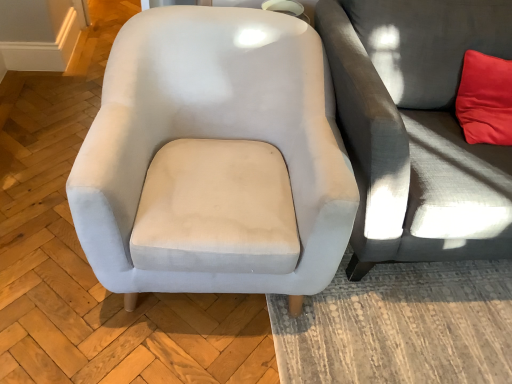
The image size is (512, 384). What do you see at coordinates (214, 159) in the screenshot?
I see `satin light gray armchair at center` at bounding box center [214, 159].

Find the location of a particular element. This screenshot has height=384, width=512. satin light gray armchair at center is located at coordinates (214, 159).

Image resolution: width=512 pixels, height=384 pixels. What do you see at coordinates (417, 128) in the screenshot? I see `gray fabric couch at right` at bounding box center [417, 128].

Locate an element on the screen. This screenshot has height=384, width=512. gray fabric couch at right is located at coordinates (417, 128).

You are a GUI agent. You are given a task and a screenshot of the screen. Output one action in this format:
    pyautogui.click(x=<x>, y=<y>)
    Task: Click on the satin light gray armchair at center
    
    Given the screenshot: What is the action you would take?
    pyautogui.click(x=214, y=159)

Considering the positions of objects satin light gray armchair at center and gray fabric couch at right in the image provided, who is more to the left, satin light gray armchair at center or gray fabric couch at right?

Positioned to the left is satin light gray armchair at center.

Is the depth of satin light gray armchair at center greater than that of gray fabric couch at right?

No.

Considering the points (188, 27) and (430, 36), which point is in front, point (188, 27) or point (430, 36)?

Positioned in front is point (188, 27).

From the image's perspective, which is above, satin light gray armchair at center or gray fabric couch at right?

gray fabric couch at right, from the image's perspective.

From a real-world perspective, is satin light gray armchair at center positioned under gray fabric couch at right based on gravity?

Correct, in the physical world, satin light gray armchair at center is lower than gray fabric couch at right.

Is satin light gray armchair at center wider or thinner than gray fabric couch at right?

Considering their sizes, satin light gray armchair at center looks slimmer than gray fabric couch at right.

Is satin light gray armchair at center taller than gray fabric couch at right?

No, satin light gray armchair at center is not taller than gray fabric couch at right.

Does satin light gray armchair at center have a smaller size compared to gray fabric couch at right?

Indeed, satin light gray armchair at center has a smaller size compared to gray fabric couch at right.

Could gray fabric couch at right be considered to be inside satin light gray armchair at center?

No, gray fabric couch at right is not inside satin light gray armchair at center.

Is satin light gray armchair at center with gray fabric couch at right?

satin light gray armchair at center and gray fabric couch at right are not in contact.

Is satin light gray armchair at center oriented away from gray fabric couch at right?

No, satin light gray armchair at center is not facing the opposite direction of gray fabric couch at right.

How different are the orientations of satin light gray armchair at center and gray fabric couch at right in degrees?

The angle between the facing direction of satin light gray armchair at center and the facing direction of gray fabric couch at right is 4.47 degrees.

There is a satin light gray armchair at center. Where is `studio couch above it (from a real-world perspective)`? The height and width of the screenshot is (384, 512). studio couch above it (from a real-world perspective) is located at coordinates (417, 128).

In the scene shown: Between gray fabric couch at right and satin light gray armchair at center, which one appears on the left side from the viewer's perspective?

Positioned to the left is satin light gray armchair at center.

Considering the positions of objects gray fabric couch at right and satin light gray armchair at center in the image provided, who is in front, gray fabric couch at right or satin light gray armchair at center?

Positioned in front is satin light gray armchair at center.

Between point (440, 253) and point (207, 277), which one is positioned in front?

Positioned in front is point (207, 277).

From the image's perspective, which one is positioned higher, gray fabric couch at right or satin light gray armchair at center?

gray fabric couch at right, from the image's perspective.

From a real-world perspective, is gray fabric couch at right on satin light gray armchair at center?

Correct, in the physical world, gray fabric couch at right is higher than satin light gray armchair at center.

Considering the relative sizes of gray fabric couch at right and satin light gray armchair at center in the image provided, is gray fabric couch at right wider than satin light gray armchair at center?

Indeed, gray fabric couch at right has a greater width compared to satin light gray armchair at center.

Which of these two, gray fabric couch at right or satin light gray armchair at center, stands shorter?

satin light gray armchair at center.

Considering the relative sizes of gray fabric couch at right and satin light gray armchair at center in the image provided, is gray fabric couch at right bigger than satin light gray armchair at center?

Correct, gray fabric couch at right is larger in size than satin light gray armchair at center.

Is gray fabric couch at right spatially inside satin light gray armchair at center, or outside of it?

gray fabric couch at right is not enclosed by satin light gray armchair at center.

From the picture: Are gray fabric couch at right and satin light gray armchair at center located far from each other?

That's not correct — gray fabric couch at right is a little close to satin light gray armchair at center.

Is gray fabric couch at right facing towards satin light gray armchair at center?

No, gray fabric couch at right is not turned towards satin light gray armchair at center.

This screenshot has height=384, width=512. What are the coordinates of `studio couch to the right of satin light gray armchair at center` in the screenshot? It's located at (417, 128).

At what (x,y) coordinates should I click in order to perform the action: click on chair on the left of gray fabric couch at right. Please return your answer as a coordinate pair (x, y). This screenshot has width=512, height=384. Looking at the image, I should click on (214, 159).

At what (x,y) coordinates should I click in order to perform the action: click on chair that appears below the gray fabric couch at right (from the image's perspective). Please return your answer as a coordinate pair (x, y). Looking at the image, I should click on (214, 159).